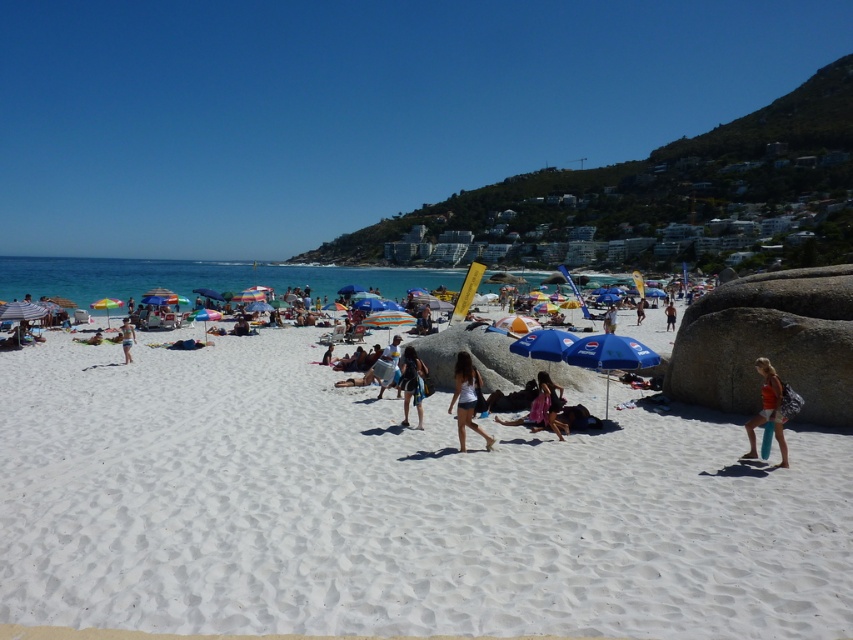
Question: Which of the following is the farthest from the observer?

Choices:
 (A) (642, 362)
 (B) (762, 413)
 (C) (485, 436)
 (D) (126, 340)

Answer: (D)

Question: Can you confirm if white matte shorts at center is positioned to the left of white sand at center?

Choices:
 (A) no
 (B) yes

Answer: (A)

Question: Which point is farther to the camera?

Choices:
 (A) blue fabric umbrella at center
 (B) green fabric umbrella at center
 (C) white matte shorts at center

Answer: (B)

Question: Is white sand at center to the right of green fabric umbrella at center from the viewer's perspective?

Choices:
 (A) yes
 (B) no

Answer: (A)

Question: Which object is farther from the camera taking this photo?

Choices:
 (A) black fabric dress at center
 (B) matte pink swimsuit at center

Answer: (A)

Question: Considering the relative positions of white matte shorts at center and white sand at center in the image provided, where is white matte shorts at center located with respect to white sand at center?

Choices:
 (A) right
 (B) left

Answer: (A)